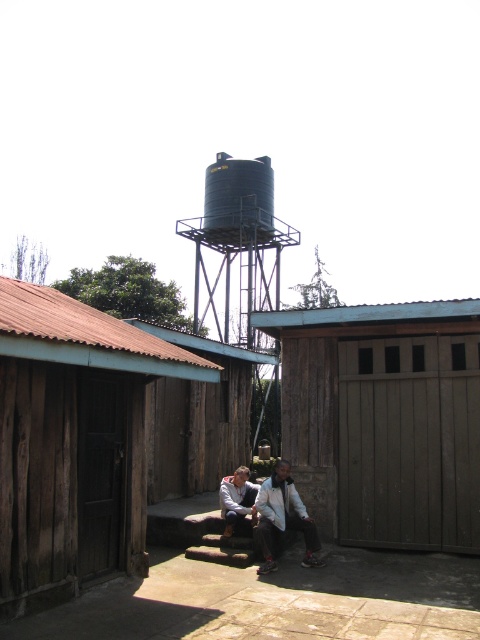
Between wooden hut at left and light gray fabric jacket at center, which one is positioned lower?

light gray fabric jacket at center

Which is behind, point (72, 380) or point (255, 493)?

The point (255, 493) is behind.

Where is `wooden hut at left`? This screenshot has width=480, height=640. wooden hut at left is located at coordinates (72, 442).

Where is `wooden hut at left`? This screenshot has width=480, height=640. wooden hut at left is located at coordinates [x=72, y=442].

Between wooden hut at left and wooden hut at center, which one has less height?

wooden hut at center

Which is below, wooden hut at left or wooden hut at center?

wooden hut at center

Identify the location of wooden hut at left. This screenshot has height=640, width=480. (72, 442).

Is brown wooden hut at center-right taller than white cotton shirt at center?

Yes.

Who is more distant from viewer, (338,381) or (283,465)?

Positioned behind is point (338,381).

Where is `brown wooden hut at center-right`? Image resolution: width=480 pixels, height=640 pixels. brown wooden hut at center-right is located at coordinates (384, 419).

Where is `brown wooden hut at center-right`? Image resolution: width=480 pixels, height=640 pixels. brown wooden hut at center-right is located at coordinates (384, 419).